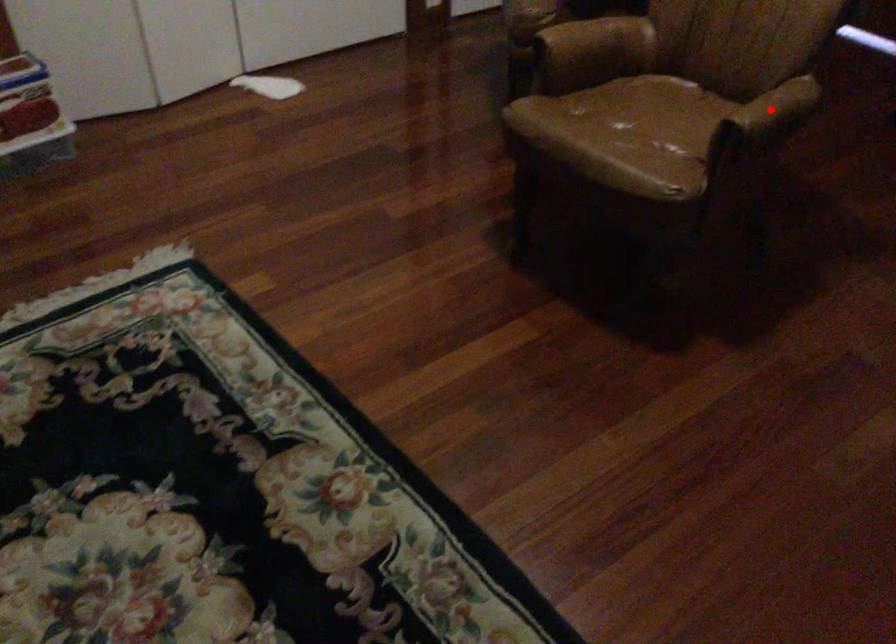
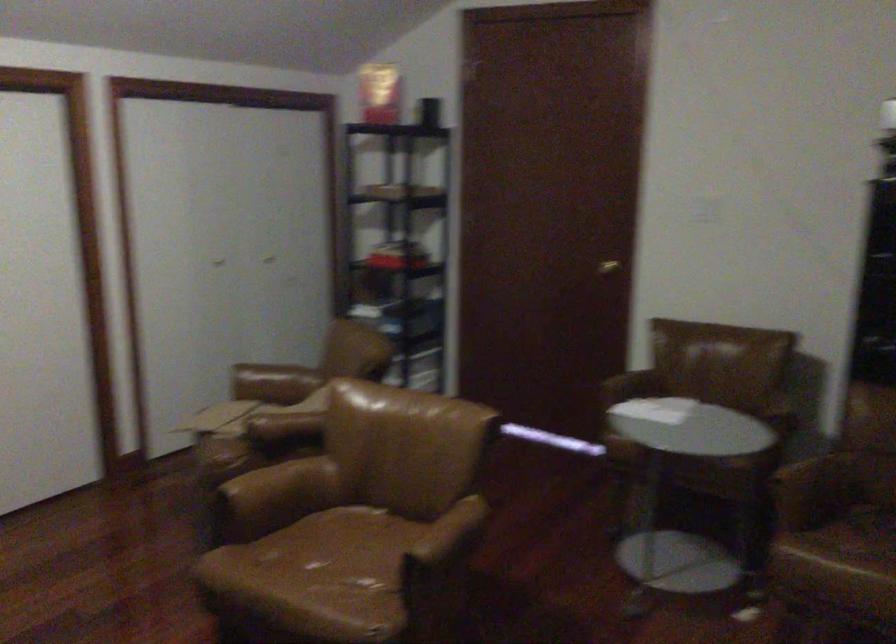
Find the pixel in the second image that matches the highlighted location in the first image.

(448, 536)